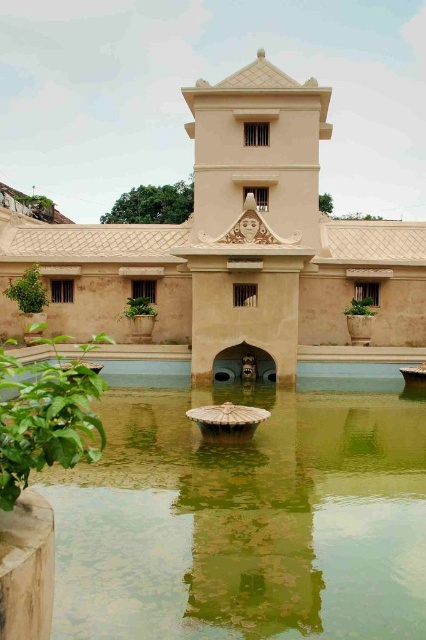
You are standing in front of the beige stone palace at center and want to cross to the other side of the green stone water at center. Which direction should you walk to reach the opposite side of the water?

The green stone water at center is positioned on the right side of the beige stone palace at center. To reach the opposite side of the water, you should walk to the left side of the beige stone palace at center.

You are standing in front of the traditional South Asian building. You see a point labeled as point [245,520]. Based on the scene, what is the object at this point?

The point [245,520] corresponds to the green stone water at center.

You are a tourist standing in front of the beige stone palace at center. You want to take a photo of the palace with the green stone water at center in the foreground. Which object should be closer to the camera to include both in the frame?

The green stone water at center is smaller in size compared to the beige stone palace at center. To include both in the frame, the green stone water at center should be closer to the camera since it is smaller and needs to be positioned in the foreground to balance the composition.